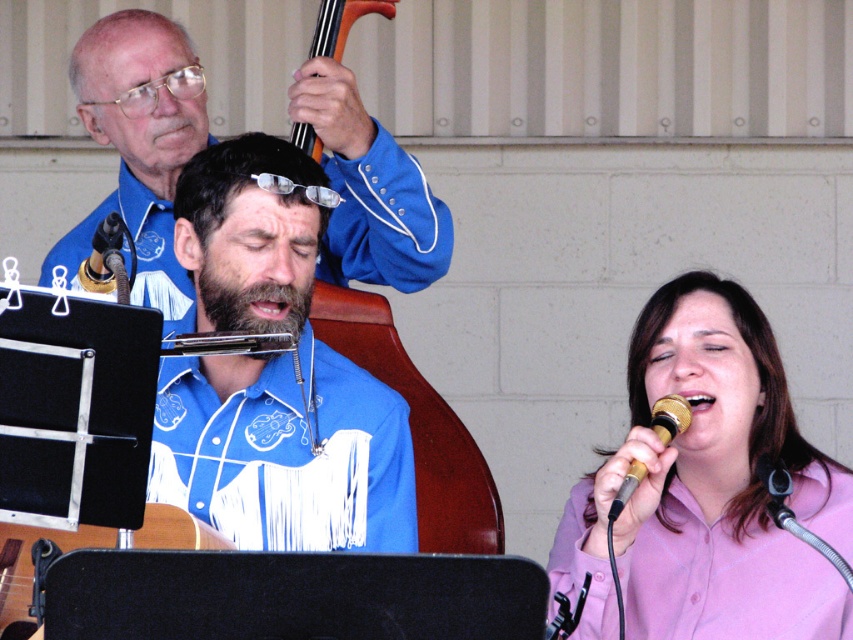
Question: Which of these objects is positioned closest to the blue fringed shirt at center?

Choices:
 (A) black matte microphone at left
 (B) orange wood violin at upper center
 (C) gold metallic microphone at lower right
 (D) blue denim shirt at upper left

Answer: (A)

Question: Is blue denim shirt at upper left thinner than pink satin shirt at lower right?

Choices:
 (A) no
 (B) yes

Answer: (A)

Question: Does pink satin shirt at right have a lesser width compared to orange wood violin at upper center?

Choices:
 (A) yes
 (B) no

Answer: (B)

Question: Among these objects, which one is farthest from the camera?

Choices:
 (A) orange wood violin at upper center
 (B) blue fringed shirt at center
 (C) pink satin shirt at right
 (D) pink satin shirt at lower right

Answer: (A)

Question: Which is nearer to the black matte microphone at left?

Choices:
 (A) pink satin shirt at lower right
 (B) orange wood violin at upper center
 (C) blue fringed shirt at center
 (D) gold metallic microphone at lower right

Answer: (C)

Question: Can you confirm if blue denim shirt at upper left is smaller than orange wood violin at upper center?

Choices:
 (A) yes
 (B) no

Answer: (B)